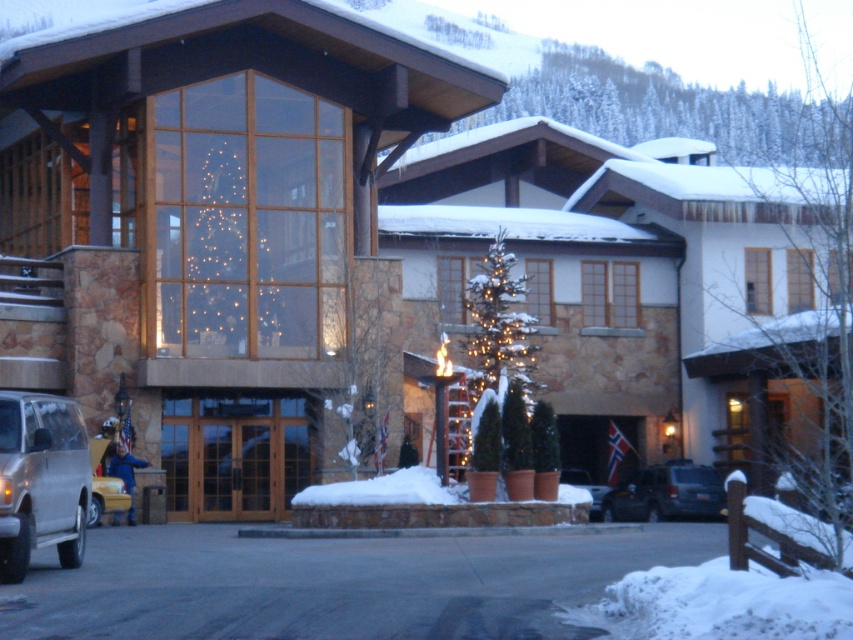
Question: Which point is closer to the camera?

Choices:
 (A) yellow matte taxi at lower left
 (B) gold metallic suv at lower left
 (C) white fluffy snow at center
 (D) matte silver suv at center

Answer: (B)

Question: Based on their relative distances, which object is nearer to the white fluffy snow at center?

Choices:
 (A) dark gray suv at center
 (B) matte silver suv at center
 (C) gold metallic suv at lower left

Answer: (B)

Question: Which object appears closest to the camera in this image?

Choices:
 (A) dark gray suv at center
 (B) white fluffy snow at center
 (C) gold metallic suv at lower left
 (D) matte silver suv at center

Answer: (C)

Question: Does yellow matte taxi at lower left have a greater width compared to matte silver suv at center?

Choices:
 (A) no
 (B) yes

Answer: (A)

Question: From the image, what is the correct spatial relationship of dark gray suv at center in relation to white fluffy snow at center?

Choices:
 (A) left
 (B) right

Answer: (B)

Question: Is gold metallic suv at lower left smaller than yellow matte taxi at lower left?

Choices:
 (A) no
 (B) yes

Answer: (A)